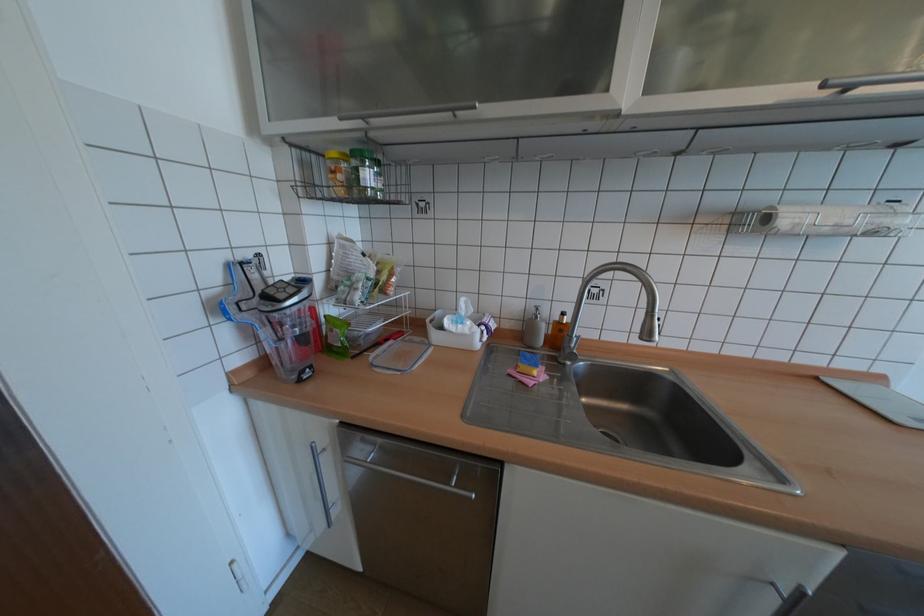
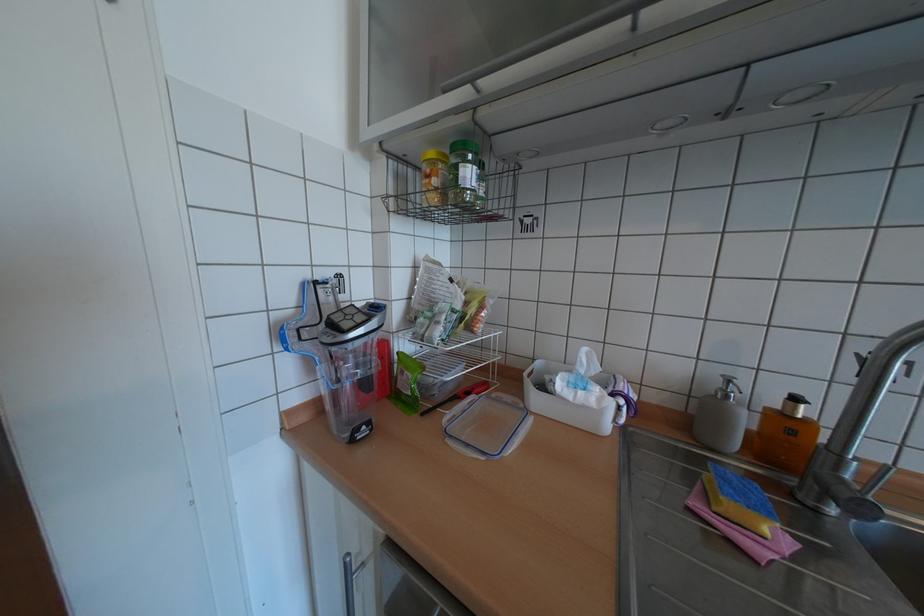
Where in the second image is the point corresponding to point 572,314 from the first image?

(805, 399)